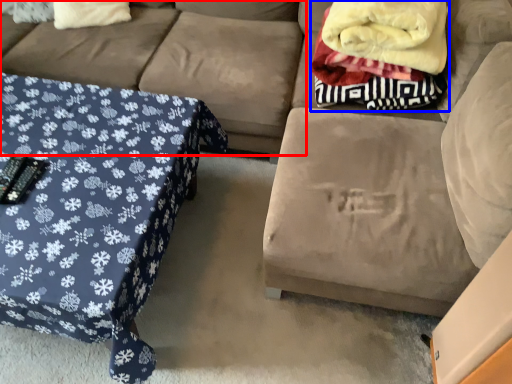
Question: Which point is further to the camera, couch (highlighted by a red box) or blanket (highlighted by a blue box)?

Choices:
 (A) couch
 (B) blanket

Answer: (A)